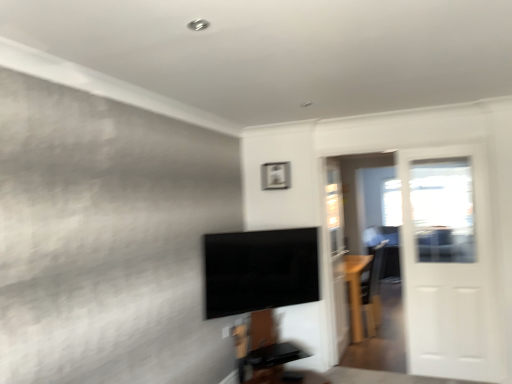
Question: From a real-world perspective, is matte silver picture frame at upper center positioned over white glossy door at right based on gravity?

Choices:
 (A) yes
 (B) no

Answer: (A)

Question: Considering the relative positions of matte silver picture frame at upper center and white glossy door at right in the image provided, is matte silver picture frame at upper center to the right of white glossy door at right from the viewer's perspective?

Choices:
 (A) no
 (B) yes

Answer: (A)

Question: Does matte silver picture frame at upper center lie behind white glossy door at right?

Choices:
 (A) no
 (B) yes

Answer: (B)

Question: Can you confirm if matte silver picture frame at upper center is bigger than white glossy door at right?

Choices:
 (A) yes
 (B) no

Answer: (B)

Question: From a real-world perspective, does matte silver picture frame at upper center sit lower than white glossy door at right?

Choices:
 (A) yes
 (B) no

Answer: (B)

Question: Can white glossy door at right be found inside matte silver picture frame at upper center?

Choices:
 (A) yes
 (B) no

Answer: (B)

Question: Does black glossy tv at center appear on the left side of light brown wood table at right?

Choices:
 (A) no
 (B) yes

Answer: (B)

Question: From a real-world perspective, is black glossy tv at center physically below light brown wood table at right?

Choices:
 (A) yes
 (B) no

Answer: (B)

Question: Is black glossy tv at center looking in the opposite direction of light brown wood table at right?

Choices:
 (A) no
 (B) yes

Answer: (A)

Question: Is black glossy tv at center smaller than light brown wood table at right?

Choices:
 (A) no
 (B) yes

Answer: (B)

Question: Is black glossy tv at center far from light brown wood table at right?

Choices:
 (A) no
 (B) yes

Answer: (B)

Question: Is black glossy tv at center shorter than light brown wood table at right?

Choices:
 (A) yes
 (B) no

Answer: (A)

Question: Is white glossy door at right inside black glossy tv at center?

Choices:
 (A) no
 (B) yes

Answer: (A)